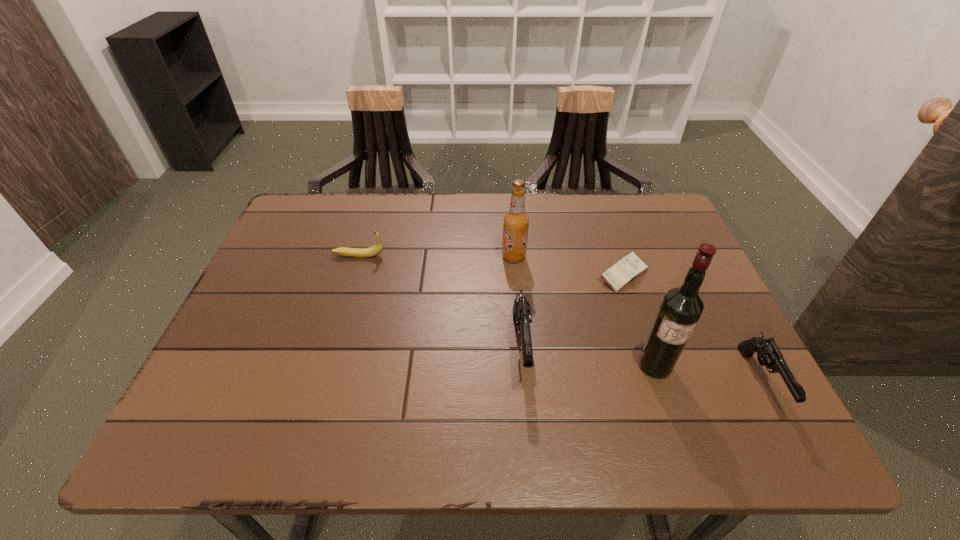
Find the location of a particular element. This screenshot has width=960, height=540. vacant space located 0.090m on the front label of the fifth shortest object is located at coordinates (468, 256).

Find the location of `free point located 0.140m on the front label of the fifth shortest object`. free point located 0.140m on the front label of the fifth shortest object is located at coordinates (449, 256).

The image size is (960, 540). I want to click on vacant space located on the front label of the fifth shortest object, so click(x=397, y=256).

What are the coordinates of `wine bottle that is at the near edge` in the screenshot? It's located at (681, 307).

You are a GUI agent. You are given a task and a screenshot of the screen. Output one action in this format:
    pyautogui.click(x=<x>, y=<y>)
    Task: Click on the gun at the right edge
    
    Given the screenshot: What is the action you would take?
    pyautogui.click(x=768, y=354)

The height and width of the screenshot is (540, 960). In order to click on diary situated at the right edge in this screenshot , I will do `click(628, 268)`.

Where is `wine bottle that is at the right edge`? The width and height of the screenshot is (960, 540). wine bottle that is at the right edge is located at coordinates (681, 307).

At what (x,y) coordinates should I click in order to perform the action: click on gun that is at the near right corner. Please return your answer as a coordinate pair (x, y). This screenshot has width=960, height=540. Looking at the image, I should click on (768, 354).

Locate an element on the screen. The image size is (960, 540). wine bottle present at the near right corner is located at coordinates (681, 307).

Identify the location of free region at the far edge of the desktop. The image size is (960, 540). (578, 225).